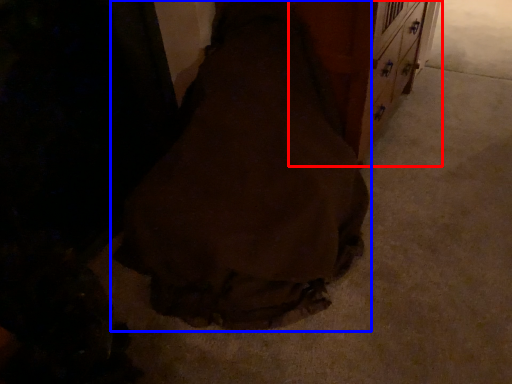
Question: Which object appears farthest to the camera in this image, dresser (highlighted by a red box) or fancy dress (highlighted by a blue box)?

Choices:
 (A) dresser
 (B) fancy dress

Answer: (A)